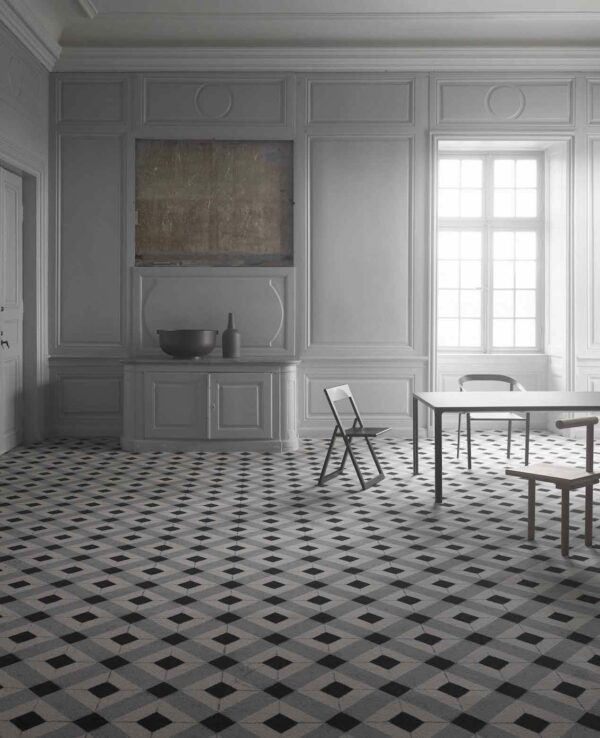
Find the location of a particular element. The width and height of the screenshot is (600, 738). table leg is located at coordinates (414, 437), (437, 446).